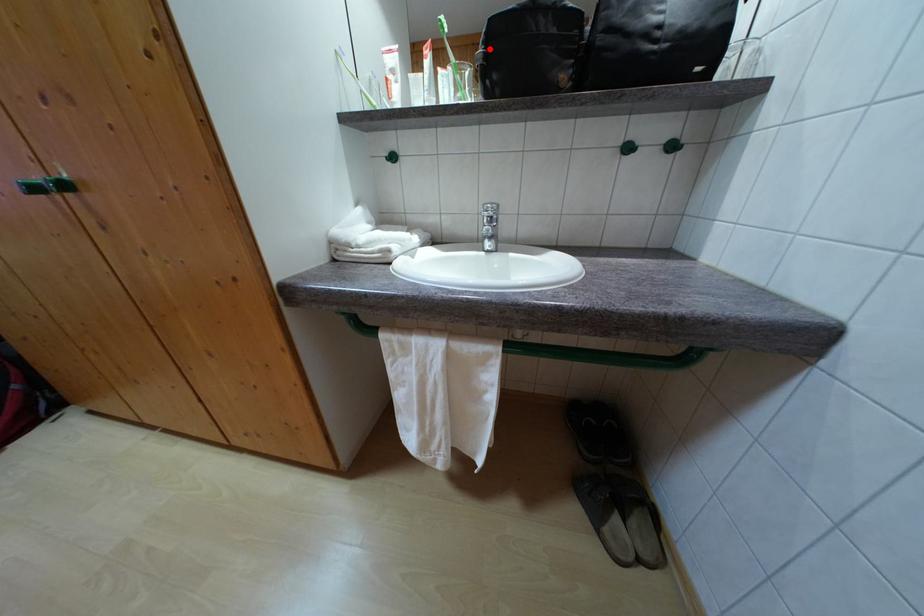
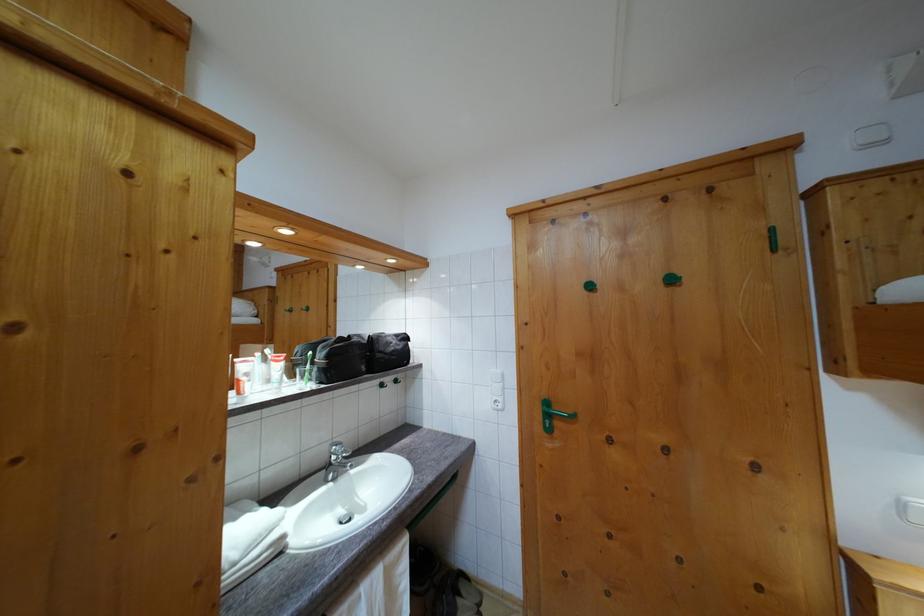
Find the pixel in the second image that matches the highlighted location in the first image.

(332, 363)